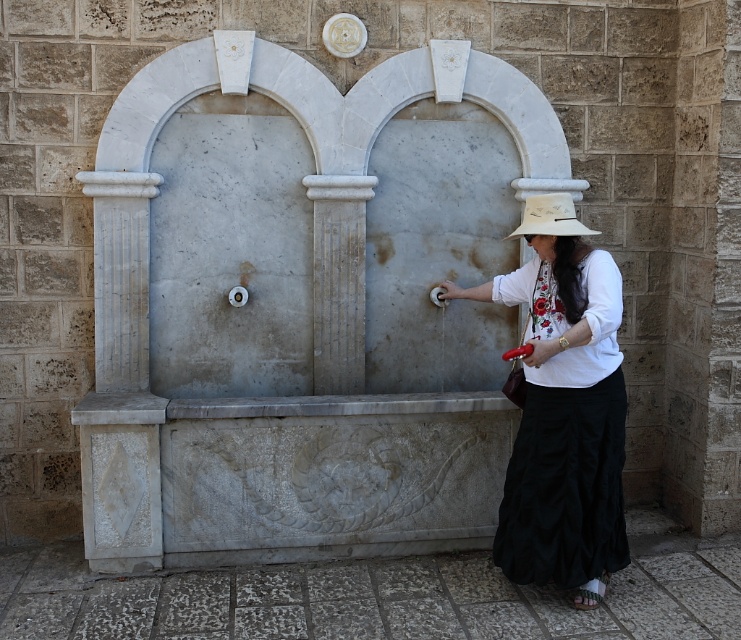
Question: Which point is closer to the camera taking this photo?

Choices:
 (A) (545, 220)
 (B) (518, 474)
 (C) (319, 321)

Answer: (A)

Question: Is white cotton shirt at center positioned in front of white marble pillar at center?

Choices:
 (A) no
 (B) yes

Answer: (B)

Question: Can you confirm if white marble pillar at center is wider than white fabric hat at right?

Choices:
 (A) yes
 (B) no

Answer: (A)

Question: Does white cotton shirt at center appear on the left side of white fabric hat at right?

Choices:
 (A) yes
 (B) no

Answer: (A)

Question: Estimate the real-world distances between objects in this image. Which object is farther from the white marble pillar at center?

Choices:
 (A) white cotton shirt at center
 (B) white fabric hat at right

Answer: (B)

Question: Which object is closer to the camera taking this photo?

Choices:
 (A) white marble pillar at center
 (B) white cotton shirt at center
 (C) white fabric hat at right

Answer: (B)